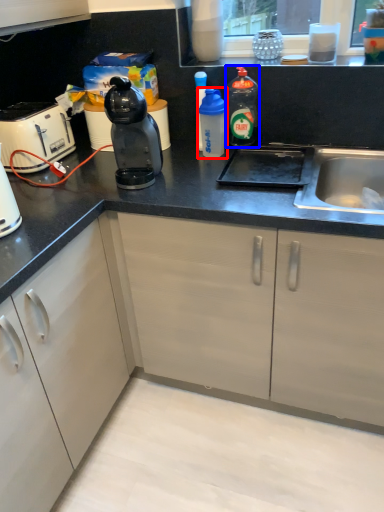
Question: Which object appears farthest to the camera in this image, bottle (highlighted by a red box) or bottle (highlighted by a blue box)?

Choices:
 (A) bottle
 (B) bottle

Answer: (B)